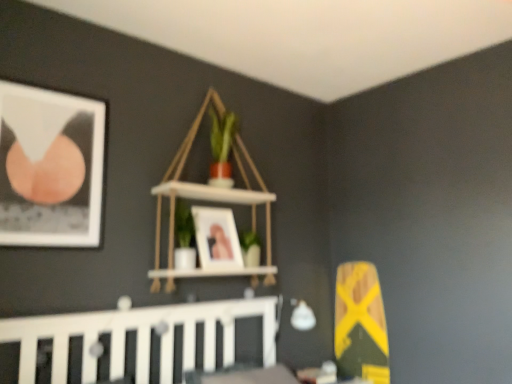
Question: Is white wooden crib at lower left turned away from white wood shelf at upper center?

Choices:
 (A) yes
 (B) no

Answer: (B)

Question: From the image's perspective, is white wooden crib at lower left over white wood shelf at upper center?

Choices:
 (A) no
 (B) yes

Answer: (A)

Question: Is white wooden crib at lower left further to camera compared to white wood shelf at upper center?

Choices:
 (A) yes
 (B) no

Answer: (B)

Question: Is white wooden crib at lower left wider than white wood shelf at upper center?

Choices:
 (A) no
 (B) yes

Answer: (B)

Question: Is white wooden crib at lower left aimed at white wood shelf at upper center?

Choices:
 (A) no
 (B) yes

Answer: (A)

Question: In the image, is white wood shelf at upper center on the left side or the right side of matte black picture frame at upper left, the second picture frame viewed from the back?

Choices:
 (A) right
 (B) left

Answer: (A)

Question: From a real-world perspective, is white wood shelf at upper center positioned above or below matte black picture frame at upper left, which ranks as the second picture frame in right-to-left order?

Choices:
 (A) above
 (B) below

Answer: (A)

Question: Looking at their shapes, would you say white wood shelf at upper center is wider or thinner than matte black picture frame at upper left, marked as the 1th picture frame in a left-to-right arrangement?

Choices:
 (A) thin
 (B) wide

Answer: (B)

Question: Would you say white wood shelf at upper center is inside or outside matte black picture frame at upper left, arranged as the 1th picture frame when viewed from the front?

Choices:
 (A) outside
 (B) inside

Answer: (A)

Question: From the image's perspective, is matte black picture frame at upper left, marked as the 1th picture frame in a left-to-right arrangement, positioned above or below white wooden crib at lower left?

Choices:
 (A) above
 (B) below

Answer: (A)

Question: Do you think matte black picture frame at upper left, the second picture frame viewed from the back, is within white wooden crib at lower left, or outside of it?

Choices:
 (A) outside
 (B) inside

Answer: (A)

Question: Is matte black picture frame at upper left, the second picture frame viewed from the back, in front of or behind white wooden crib at lower left in the image?

Choices:
 (A) behind
 (B) front

Answer: (A)

Question: Considering the positions of matte black picture frame at upper left, arranged as the 1th picture frame when viewed from the front, and white wooden crib at lower left in the image, is matte black picture frame at upper left, arranged as the 1th picture frame when viewed from the front, wider or thinner than white wooden crib at lower left?

Choices:
 (A) thin
 (B) wide

Answer: (A)

Question: Is point (33, 97) closer or farther from the camera than point (223, 273)?

Choices:
 (A) closer
 (B) farther

Answer: (A)

Question: Choose the correct answer: Is matte black picture frame at upper left, the second picture frame viewed from the back, inside white wood shelf at upper center or outside it?

Choices:
 (A) outside
 (B) inside

Answer: (A)